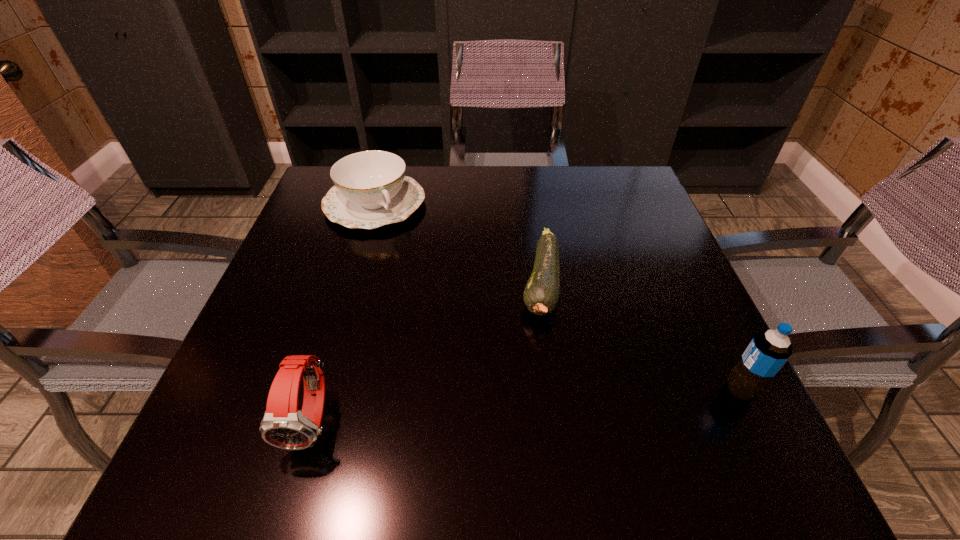
What are the coordinates of `vacant area that lies between the farthest object and the zucchini` in the screenshot? It's located at (458, 244).

This screenshot has width=960, height=540. I want to click on vacant area between the second tallest object and the soda bottle, so click(527, 405).

Locate an element on the screen. The height and width of the screenshot is (540, 960). free space between the watch and the soda bottle is located at coordinates (527, 405).

Identify the location of vacant area that lies between the shortest object and the tallest object. (640, 338).

At what (x,y) coordinates should I click in order to perform the action: click on vacant space that's between the shortest object and the watch. Please return your answer as a coordinate pair (x, y). This screenshot has height=540, width=960. Looking at the image, I should click on (427, 352).

I want to click on free space between the second tallest object and the rightmost object, so click(527, 405).

Locate an element on the screen. object that is the nearest to the third shortest object is located at coordinates (541, 294).

Identify which object is the second closest to the tallest object. Please provide its 2D coordinates. Your answer should be formatted as a tuple, i.e. [(x, y)], where the tuple contains the x and y coordinates of a point satisfying the conditions above.

[(283, 426)]